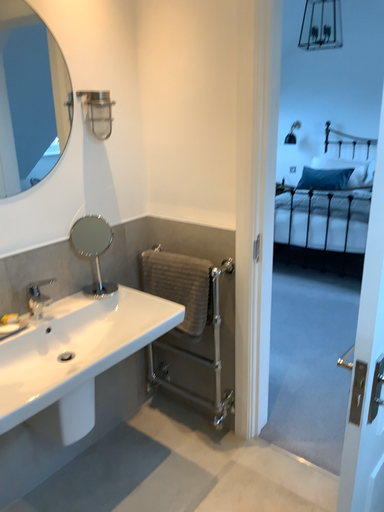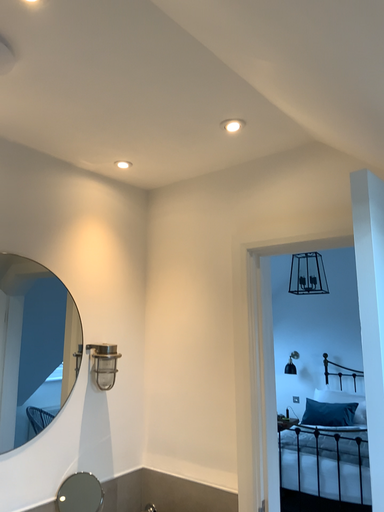
Question: Which way did the camera rotate in the video?

Choices:
 (A) rotated downward
 (B) rotated upward

Answer: (B)